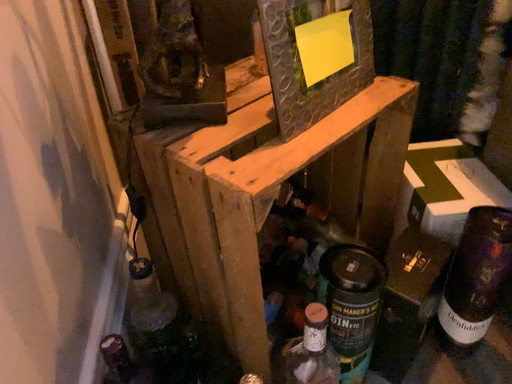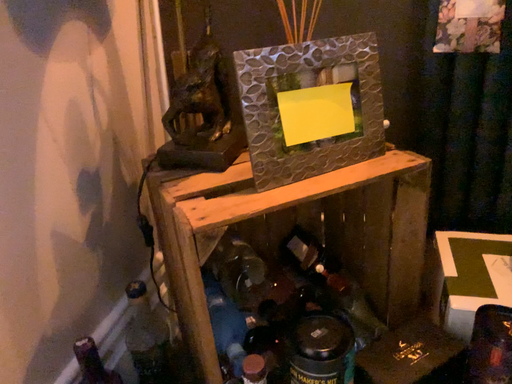
Question: Which way did the camera rotate in the video?

Choices:
 (A) rotated downward
 (B) rotated upward

Answer: (B)